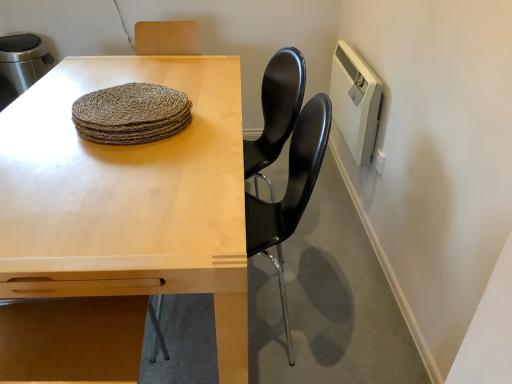
This screenshot has height=384, width=512. What are the coordinates of `vacant space in front of natural woven placemat at center` in the screenshot? It's located at (111, 178).